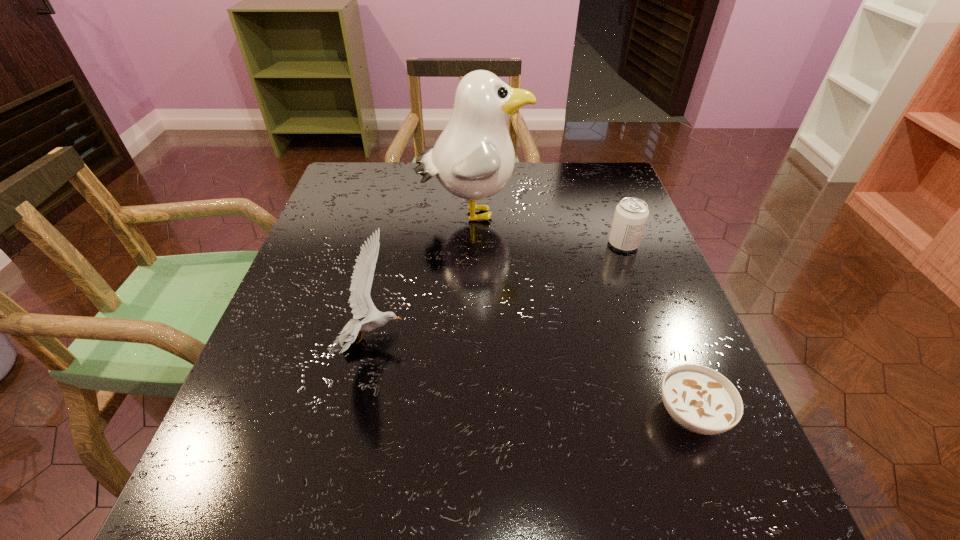
You are a GUI agent. You are given a task and a screenshot of the screen. Output one action in this format:
    pyautogui.click(x=<x>, y=<y>)
    Task: Click on the object positioned at the far edge
    The width and height of the screenshot is (960, 540).
    Given the screenshot: What is the action you would take?
    pyautogui.click(x=473, y=158)

Identify the location of object that is at the left edge. (361, 304).

Where is `soda can at the right edge`? The height and width of the screenshot is (540, 960). soda can at the right edge is located at coordinates (631, 214).

Where is `soup bowl positioned at the right edge`? The image size is (960, 540). soup bowl positioned at the right edge is located at coordinates (700, 399).

This screenshot has height=540, width=960. What are the coordinates of `blank area at the far edge` in the screenshot? It's located at (403, 185).

You are a GUI agent. You are given a task and a screenshot of the screen. Output one action in this format:
    pyautogui.click(x=<x>, y=<y>)
    Task: Click on the free space at the left edge of the desktop
    
    Given the screenshot: What is the action you would take?
    click(339, 325)

This screenshot has width=960, height=540. Find the location of `free space at the right edge of the desktop`. free space at the right edge of the desktop is located at coordinates (588, 232).

I want to click on vacant space at the far left corner of the desktop, so click(x=352, y=167).

You are a GUI agent. You are given a task and a screenshot of the screen. Output one action in this format:
    pyautogui.click(x=<x>, y=<y>)
    Task: Click on the vacant space at the far right corner of the desktop
    The height and width of the screenshot is (540, 960).
    Given the screenshot: What is the action you would take?
    pyautogui.click(x=581, y=185)

The height and width of the screenshot is (540, 960). In the image, there is a desktop. Find the location of `vacant space at the near right corner`. vacant space at the near right corner is located at coordinates (709, 493).